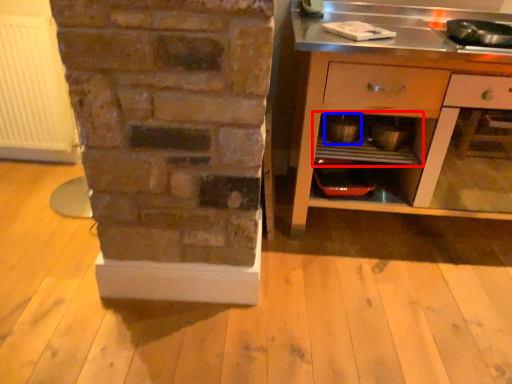
Question: Which point is closer to the camera, shelf (highlighted by a red box) or appliance (highlighted by a blue box)?

Choices:
 (A) shelf
 (B) appliance

Answer: (A)